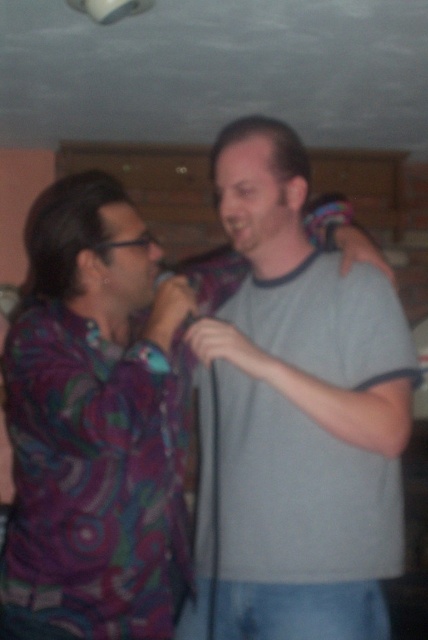
How distant is gray cotton t-shirt at center from matte black microphone at center?

gray cotton t-shirt at center and matte black microphone at center are 13.42 inches apart.

Is gray cotton t-shirt at center bigger than matte black microphone at center?

Correct, gray cotton t-shirt at center is larger in size than matte black microphone at center.

Where is `gray cotton t-shirt at center`? gray cotton t-shirt at center is located at coordinates (x=296, y=417).

This screenshot has height=640, width=428. What are the coordinates of `gray cotton t-shirt at center` in the screenshot? It's located at (296, 417).